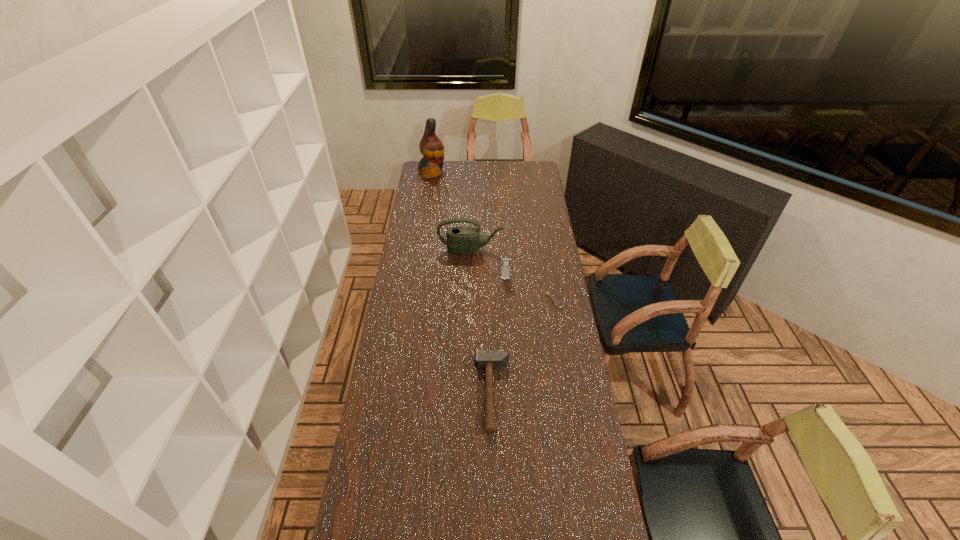
Identify the location of object at the far left corner. (431, 147).

Locate an element on the screen. The width and height of the screenshot is (960, 540). vacant space at the far edge of the desktop is located at coordinates (489, 173).

Locate an element on the screen. Image resolution: width=960 pixels, height=540 pixels. vacant region at the left edge of the desktop is located at coordinates (391, 401).

Image resolution: width=960 pixels, height=540 pixels. In the image, there is a desktop. In order to click on vacant space at the right edge in this screenshot , I will do `click(553, 420)`.

You are a GUI agent. You are given a task and a screenshot of the screen. Output one action in this format:
    pyautogui.click(x=<x>, y=<y>)
    Task: Click on the vacant region at the far right corner of the desktop
    
    Given the screenshot: What is the action you would take?
    pyautogui.click(x=539, y=172)

The image size is (960, 540). Identify the location of unoccupied area between the second shortest object and the fourth nearest object. (481, 322).

The width and height of the screenshot is (960, 540). In order to click on free space that is in between the watering can and the cellular telephone in this screenshot , I will do `click(488, 265)`.

The image size is (960, 540). In order to click on vacant area between the hammer and the farthest object in this screenshot , I will do `click(462, 284)`.

Locate an element on the screen. The width and height of the screenshot is (960, 540). vacant space that's between the second tallest object and the third farthest object is located at coordinates (488, 265).

Identify the location of blank region between the leftmost object and the watering can. This screenshot has width=960, height=540. (451, 211).